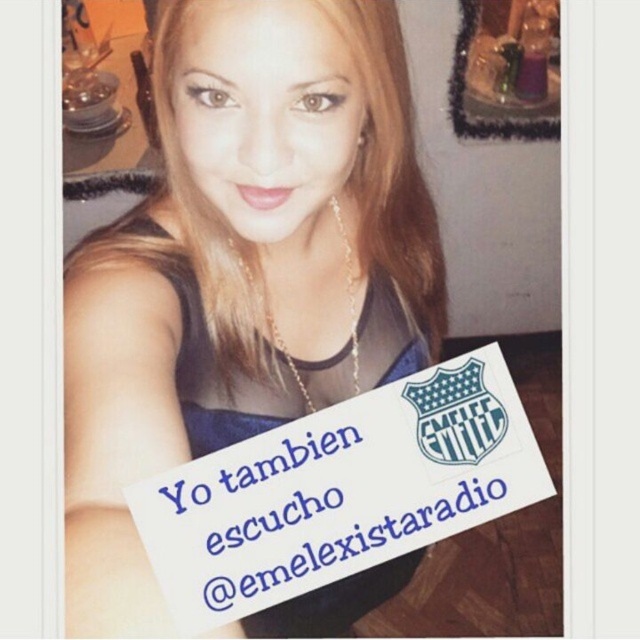
Which of these two, matte blue sign at center or white paper sign at center, stands shorter?

With less height is white paper sign at center.

You are a GUI agent. You are given a task and a screenshot of the screen. Output one action in this format:
    pyautogui.click(x=<x>, y=<y>)
    Task: Click on the matte blue sign at center
    
    Given the screenshot: What is the action you would take?
    pyautogui.click(x=243, y=266)

Who is more distant from viewer, (246, 122) or (513, 390)?

Positioned behind is point (246, 122).

Locate an element on the screen. The image size is (640, 640). matte blue sign at center is located at coordinates (243, 266).